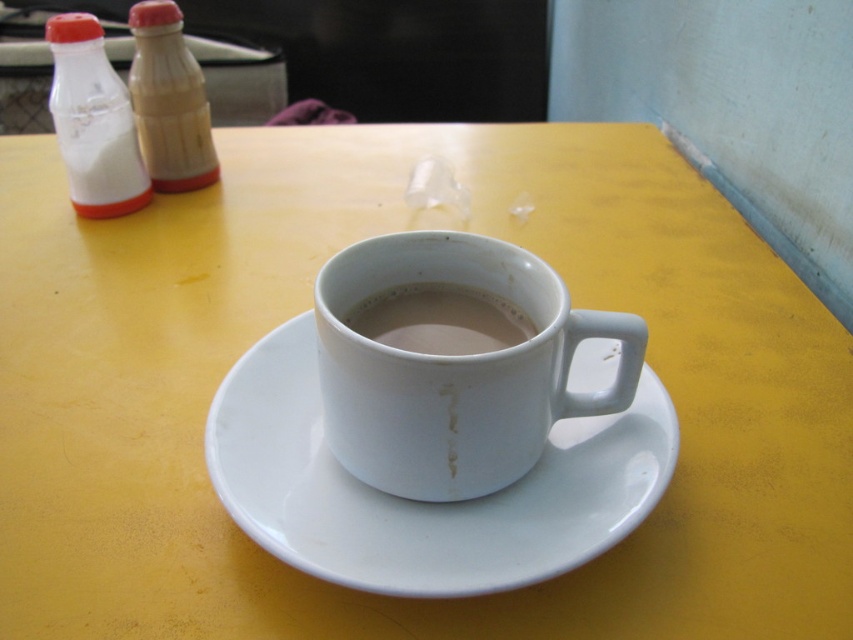
You are standing at a table with a yellow surface. There is a point marked at coordinates [422,518] on the table. If you want to place a 10 cm wide coaster exactly at this point, will there be enough space around it so that the coaster doesn,t touch any other objects on the table?

The point [422,518] is 82.28 centimeters away from the camera. Since the coaster is only 10 cm wide, there should be sufficient space around it as long as no other objects are within 5 cm from the point. However, the provided information does not mention the positions of other objects on the table, so we cannot confirm the exact spacing requirements.

You are looking at the table from above. There are two points marked on the table surface, point (434, 371) and point (492, 316). Which point is closer to you?

Point (434, 371) is closer to the viewer than point (492, 316).

You are looking at a table with a cup of coffee on a white saucer. The cup has a handle on the right side and there are two small bottles with red caps in the background. A point at coordinate (422, 502) is marked. Which object does this point correspond to?

The point at coordinate (422, 502) corresponds to the white ceramic saucer at center.